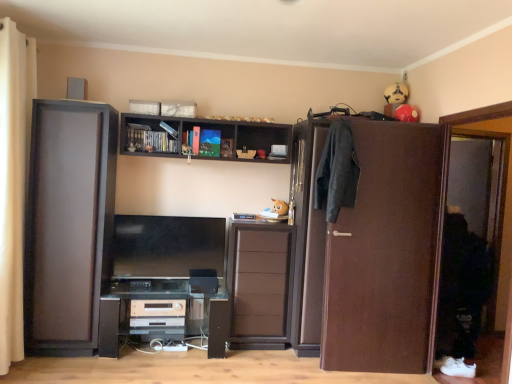
Where is `vacant area in front of brown matte cabinet at center`? The height and width of the screenshot is (384, 512). vacant area in front of brown matte cabinet at center is located at coordinates (255, 364).